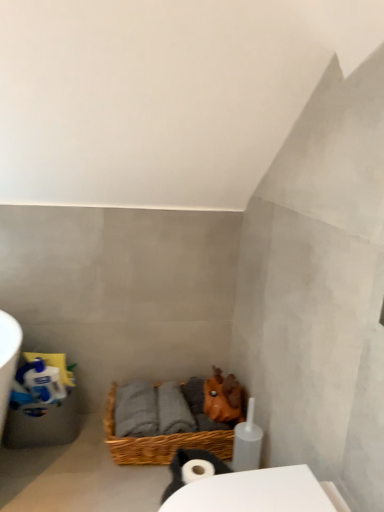
Question: From the image's perspective, is woven brown basket at lower center beneath white matte toilet paper roll at lower center?

Choices:
 (A) no
 (B) yes

Answer: (A)

Question: Can you confirm if woven brown basket at lower center is wider than white matte toilet paper roll at lower center?

Choices:
 (A) no
 (B) yes

Answer: (B)

Question: Is woven brown basket at lower center at the right side of white matte toilet paper roll at lower center?

Choices:
 (A) no
 (B) yes

Answer: (A)

Question: From a real-world perspective, is woven brown basket at lower center located higher than white matte toilet paper roll at lower center?

Choices:
 (A) no
 (B) yes

Answer: (A)

Question: Is woven brown basket at lower center not inside white matte toilet paper roll at lower center?

Choices:
 (A) no
 (B) yes

Answer: (B)

Question: Can you confirm if woven brown basket at lower center is bigger than white matte toilet paper roll at lower center?

Choices:
 (A) yes
 (B) no

Answer: (A)

Question: Does white matte toilet paper roll at lower center have a lesser width compared to woven brown basket at lower center?

Choices:
 (A) no
 (B) yes

Answer: (B)

Question: Can we say white matte toilet paper roll at lower center lies outside woven brown basket at lower center?

Choices:
 (A) yes
 (B) no

Answer: (A)

Question: From the image's perspective, is white matte toilet paper roll at lower center below woven brown basket at lower center?

Choices:
 (A) yes
 (B) no

Answer: (A)

Question: Is woven brown basket at lower center surrounded by white matte toilet paper roll at lower center?

Choices:
 (A) yes
 (B) no

Answer: (B)

Question: Considering the relative sizes of white matte toilet paper roll at lower center and woven brown basket at lower center in the image provided, is white matte toilet paper roll at lower center wider than woven brown basket at lower center?

Choices:
 (A) no
 (B) yes

Answer: (A)

Question: Does white matte toilet paper roll at lower center appear on the right side of woven brown basket at lower center?

Choices:
 (A) yes
 (B) no

Answer: (A)

Question: Considering their positions, is white matte toilet paper roll at lower center located in front of or behind woven brown basket at lower center?

Choices:
 (A) front
 (B) behind

Answer: (A)